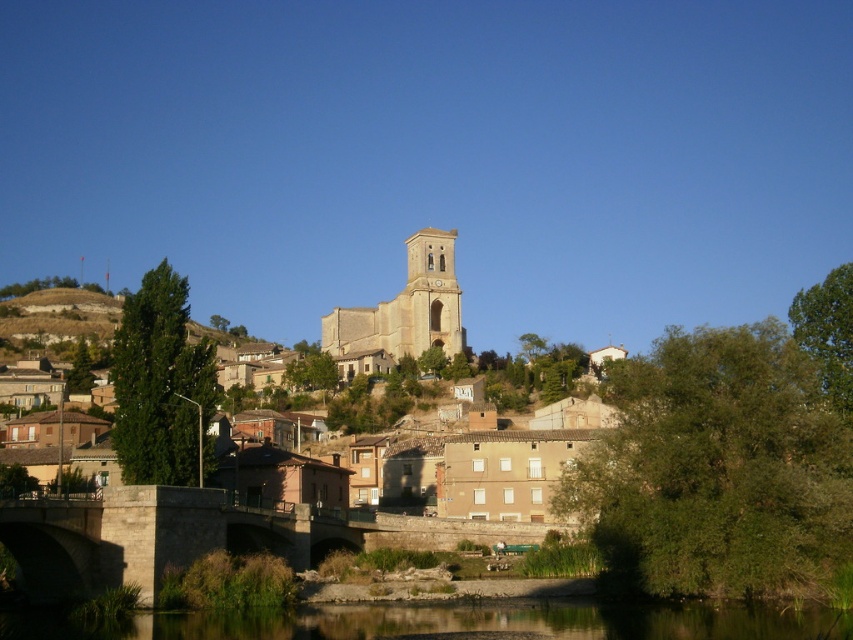
Which is below, clear water at lower center or brown rocky hillside at left?

Positioned lower is clear water at lower center.

Does point (723, 628) come closer to viewer compared to point (105, 300)?

Yes, point (723, 628) is in front of point (105, 300).

Image resolution: width=853 pixels, height=640 pixels. What do you see at coordinates (447, 621) in the screenshot?
I see `clear water at lower center` at bounding box center [447, 621].

Image resolution: width=853 pixels, height=640 pixels. In order to click on clear water at lower center in this screenshot , I will do coord(447,621).

Does clear water at lower center have a lesser width compared to stone bridge at lower center?

Incorrect, clear water at lower center's width is not less than stone bridge at lower center's.

Who is positioned more to the left, clear water at lower center or stone bridge at lower center?

stone bridge at lower center

Is point (297, 628) positioned after point (109, 506)?

No, (297, 628) is closer to viewer.

This screenshot has height=640, width=853. I want to click on clear water at lower center, so click(x=447, y=621).

In the scene shown: Can you confirm if stone bridge at lower center is positioned to the left of light beige stone tower at center?

Indeed, stone bridge at lower center is positioned on the left side of light beige stone tower at center.

Is stone bridge at lower center below light beige stone tower at center?

Yes, stone bridge at lower center is below light beige stone tower at center.

Is point (123, 509) less distant than point (345, 308)?

Yes, point (123, 509) is closer to viewer.

At what (x,y) coordinates should I click in order to perform the action: click on stone bridge at lower center. Please return your answer as a coordinate pair (x, y). Looking at the image, I should click on (151, 538).